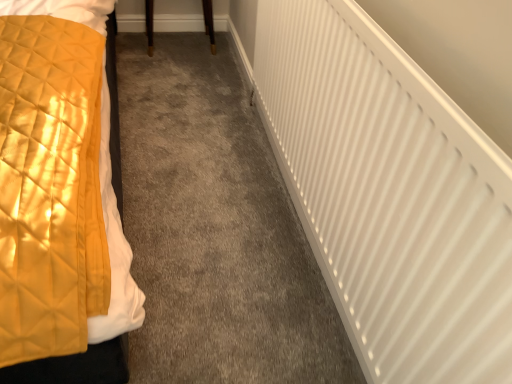
Question: Is brown wood table at upper center positioned with its back to white matte radiator at right?

Choices:
 (A) yes
 (B) no

Answer: (B)

Question: From a real-world perspective, is brown wood table at upper center physically above white matte radiator at right?

Choices:
 (A) yes
 (B) no

Answer: (B)

Question: Is brown wood table at upper center taller than white matte radiator at right?

Choices:
 (A) yes
 (B) no

Answer: (B)

Question: Is brown wood table at upper center shorter than white matte radiator at right?

Choices:
 (A) yes
 (B) no

Answer: (A)

Question: Is brown wood table at upper center to the left of white matte radiator at right from the viewer's perspective?

Choices:
 (A) no
 (B) yes

Answer: (B)

Question: Is brown wood table at upper center positioned far away from white matte radiator at right?

Choices:
 (A) yes
 (B) no

Answer: (A)

Question: Can we say white matte radiator at right lies outside brown wood table at upper center?

Choices:
 (A) no
 (B) yes

Answer: (B)

Question: Considering the relative sizes of white matte radiator at right and brown wood table at upper center in the image provided, is white matte radiator at right taller than brown wood table at upper center?

Choices:
 (A) yes
 (B) no

Answer: (A)

Question: Considering the relative sizes of white matte radiator at right and brown wood table at upper center in the image provided, is white matte radiator at right wider than brown wood table at upper center?

Choices:
 (A) yes
 (B) no

Answer: (B)

Question: From a real-world perspective, does white matte radiator at right stand above brown wood table at upper center?

Choices:
 (A) yes
 (B) no

Answer: (A)

Question: Considering the relative sizes of white matte radiator at right and brown wood table at upper center in the image provided, is white matte radiator at right thinner than brown wood table at upper center?

Choices:
 (A) yes
 (B) no

Answer: (A)

Question: Is white matte radiator at right to the right of brown wood table at upper center from the viewer's perspective?

Choices:
 (A) no
 (B) yes

Answer: (B)

Question: From a real-world perspective, is white matte radiator at right above or below brown wood table at upper center?

Choices:
 (A) below
 (B) above

Answer: (B)